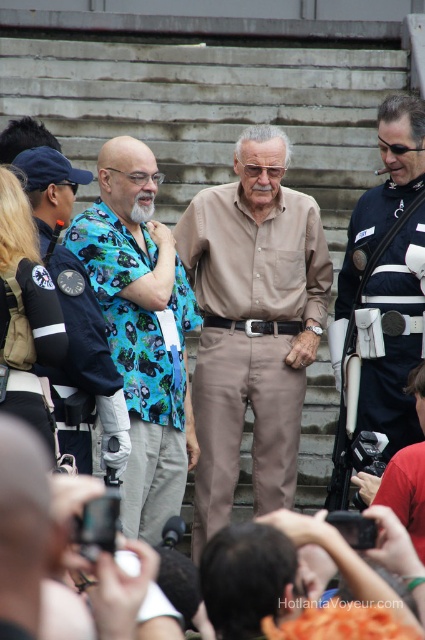
From the picture: Does dark blue uniform at right have a smaller size compared to black plastic video camera at center?

Yes, dark blue uniform at right is smaller than black plastic video camera at center.

Can you confirm if dark blue uniform at right is positioned below black plastic video camera at center?

No.

Who is more forward, [345,451] or [362,436]?

Point [362,436] is in front.

Where is `dark blue uniform at right`? This screenshot has height=640, width=425. dark blue uniform at right is located at coordinates (382, 296).

Is blue printed shirt at center below black plastic video camera at center?

No.

Is blue printed shirt at center in front of black plastic video camera at center?

No, blue printed shirt at center is further to the viewer.

Is point (181, 410) more distant than point (359, 444)?

Yes, it is.

In order to click on blue printed shirt at center in this screenshot , I will do `click(141, 330)`.

Can you confirm if matte khaki pants at center is taller than blue floral shirt at center?

No.

Is matte khaki pants at center smaller than blue floral shirt at center?

Yes.

At what (x,y) coordinates should I click in order to perform the action: click on matte khaki pants at center. Please return your answer as a coordinate pair (x, y). The image size is (425, 640). Looking at the image, I should click on (252, 324).